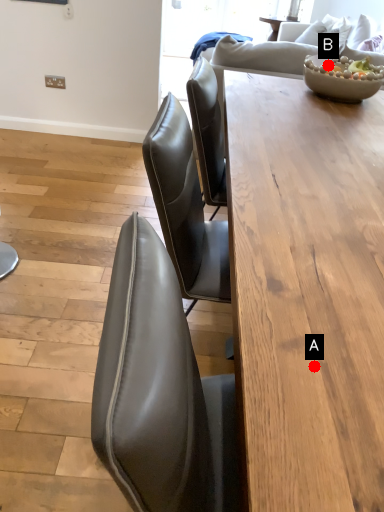
Question: Two points are circled on the image, labeled by A and B beside each circle. Which point is farther to the camera?

Choices:
 (A) A is further
 (B) B is further

Answer: (B)